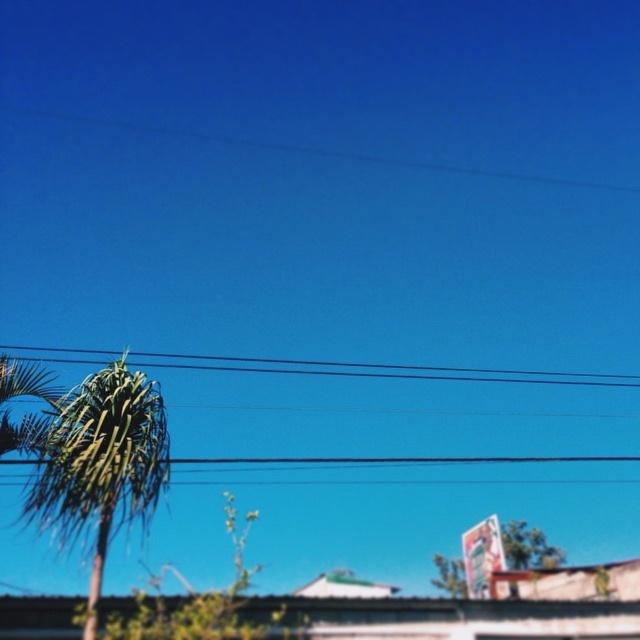
Question: Is green leafy palm tree at left positioned in front of green leafy tree at lower center?

Choices:
 (A) yes
 (B) no

Answer: (A)

Question: Which of the following is the closest to the observer?

Choices:
 (A) black wire at upper center
 (B) green leafy palm tree at left

Answer: (B)

Question: Does green leafy palm tree at left have a smaller size compared to black wire at upper center?

Choices:
 (A) no
 (B) yes

Answer: (B)

Question: Is green leafy palm tree at left positioned in front of black wire at upper center?

Choices:
 (A) no
 (B) yes

Answer: (B)

Question: Among these points, which one is nearest to the camera?

Choices:
 (A) (332, 376)
 (B) (440, 557)
 (C) (125, 522)

Answer: (C)

Question: Which point appears farthest from the camera in this image?

Choices:
 (A) (84, 396)
 (B) (451, 573)
 (C) (381, 376)

Answer: (C)